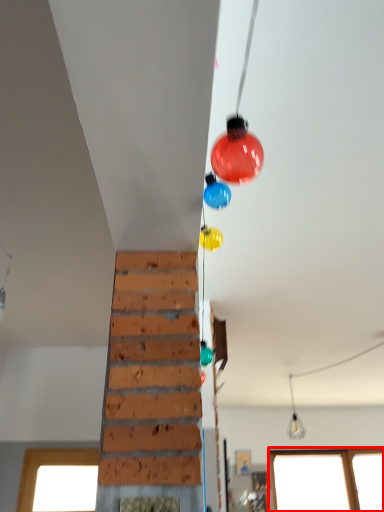
Question: From the image's perspective, what is the correct spatial positioning of window (annotated by the red box) in reference to light fixture?

Choices:
 (A) above
 (B) below

Answer: (B)